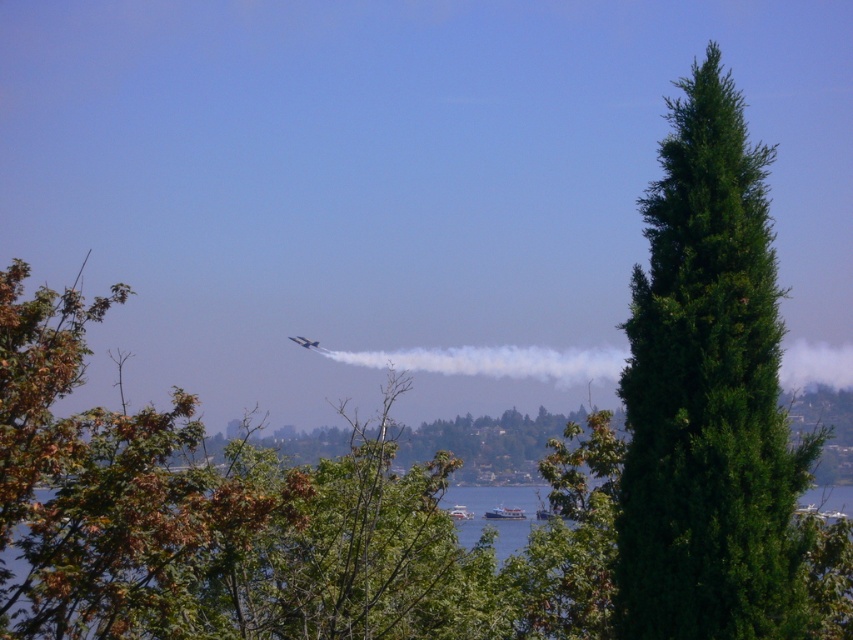
You are a photographer trying to capture both the white plastic boat at lower center and the white glossy boat at lower center in a single shot. Given their sizes, which boat would appear closer to the camera in the photo?

The white plastic boat at lower center is smaller than the white glossy boat at lower center, so it would appear farther away from the camera, making the white glossy boat at lower center closer in the photo.

You are an observer standing at the edge of the lake. You notice the green leafy tree at center and the white glossy boat at lower center. Which object appears wider from your perspective?

The green leafy tree at center appears wider than the white glossy boat at lower center because its width surpasses the boat.

You are standing at the edge of the lake and see two points marked on the water surface. The first point is labeled as point (106, 522) and the second as point (427, 349). Which point is closer to your current position?

Point (106, 522) is in front of point (427, 349), so it is closer to your current position.